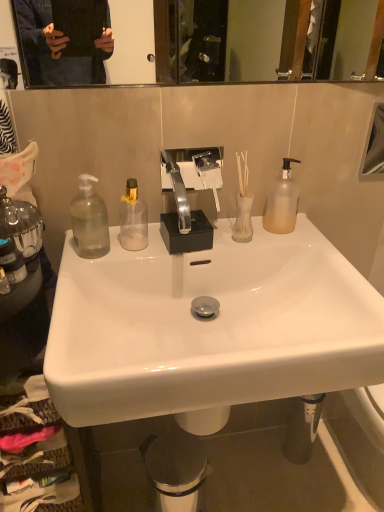
In order to click on vacant area located to the right-hand side of translucent glass vase at center in this screenshot , I will do `click(299, 245)`.